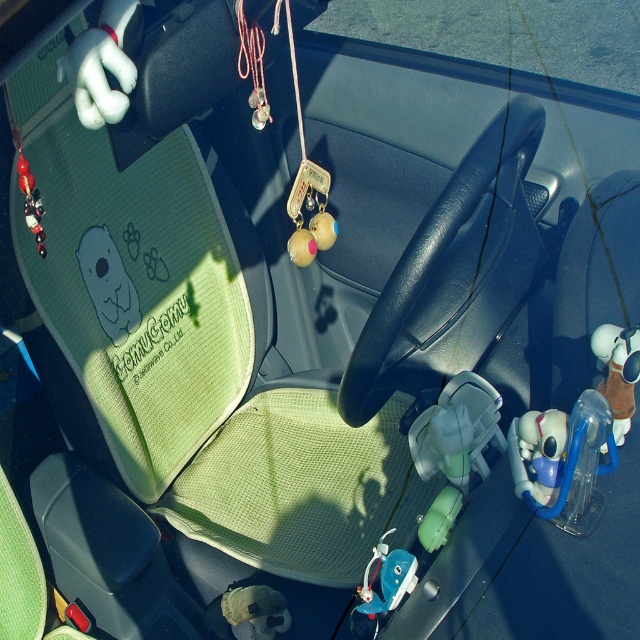
You are a passenger in the car and see the white plush toy at right and the blue plastic toy at center. Which toy is positioned higher in the driver seat area?

The white plush toy at right is located above the blue plastic toy at center, so it is positioned higher in the driver seat area.

You are a passenger in the car and want to place a smartphone between the translucent plastic toy at center and the white plush toy at right. The smartphone is 2.5 inches wide. Can it fit between them?

The distance between the translucent plastic toy at center and the white plush toy at right is 3.83 inches. Since the smartphone is 2.5 inches wide, it can fit between them as there is enough space.

You are a passenger in the car and see the translucent plastic toy at center and the blue plastic toy at center on the dashboard. Which toy is closer to you?

The translucent plastic toy at center is closer to you because it is in front of the blue plastic toy at center.